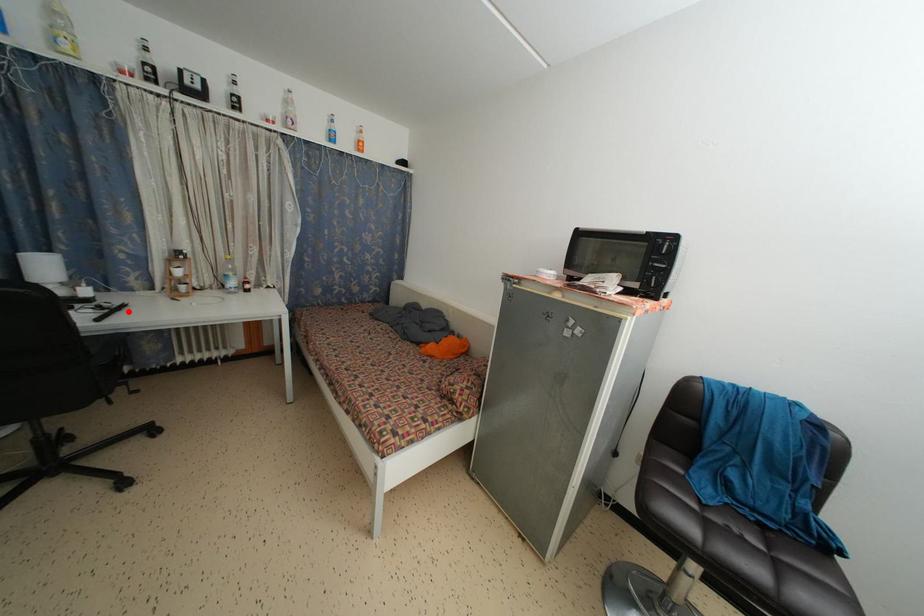
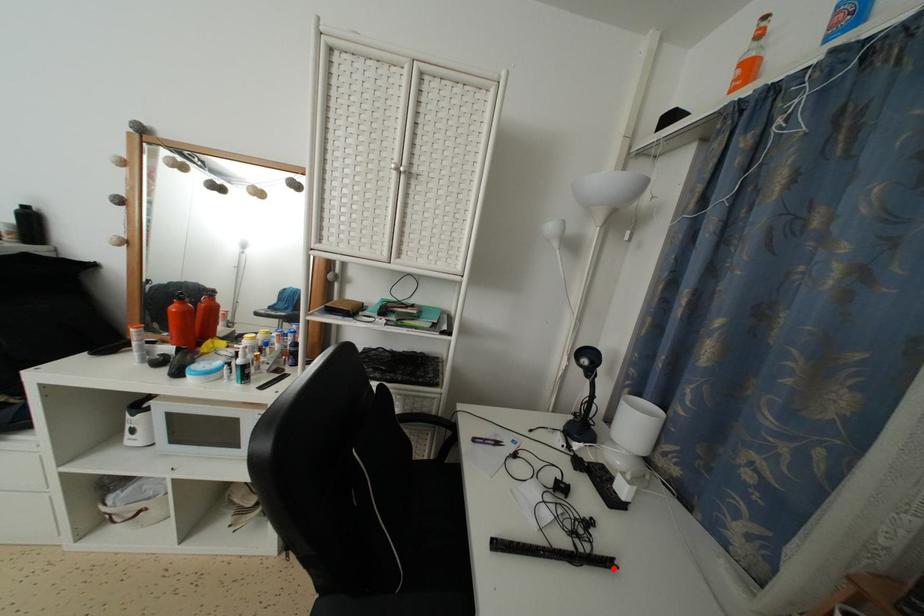
In the scene shown: I am providing you with two images of the same scene from different viewpoints. A red point is marked on the first image and another point is marked on the second image. Is the red point in image1 aligned with the point shown in image2?

Yes